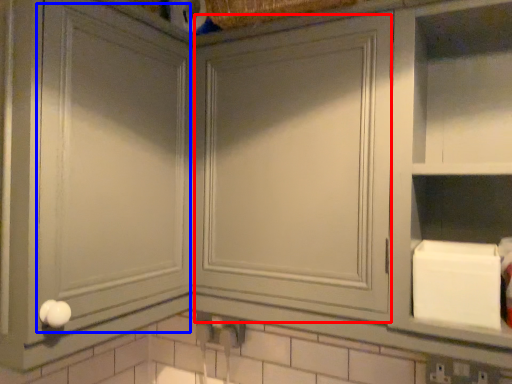
Question: Which object appears farthest to the camera in this image, glass door (highlighted by a red box) or glass door (highlighted by a blue box)?

Choices:
 (A) glass door
 (B) glass door

Answer: (A)